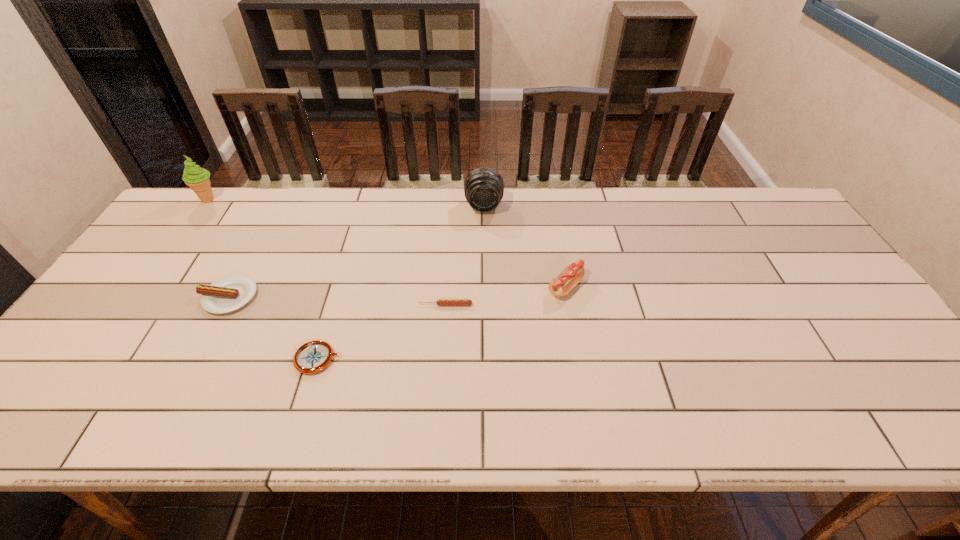
Identify the location of vacant area between the fifth shortest object and the leftmost sausage. (356, 251).

The image size is (960, 540). Find the location of `free point between the leftmost sausage and the tallest sausage`. free point between the leftmost sausage and the tallest sausage is located at coordinates (397, 292).

Locate an element on the screen. vacant space in between the leftmost sausage and the second sausage from left to right is located at coordinates (337, 301).

Locate an element on the screen. free point between the fifth object from right to left and the third tallest object is located at coordinates (397, 292).

Where is `free space that is in between the tallest sausage and the leftmost object`? This screenshot has height=540, width=960. free space that is in between the tallest sausage and the leftmost object is located at coordinates (387, 243).

You are a GUI agent. You are given a task and a screenshot of the screen. Output one action in this format:
    pyautogui.click(x=<x>, y=<y>)
    Task: Click on the object that stands as the fourth closest to the fifth shortest object
    The height and width of the screenshot is (540, 960).
    Given the screenshot: What is the action you would take?
    tap(229, 293)

The height and width of the screenshot is (540, 960). What are the coordinates of `the third closest object to the telephoto lens` in the screenshot? It's located at (312, 357).

Locate an element on the screen. This screenshot has width=960, height=540. the closest sausage to the fifth shortest object is located at coordinates (561, 285).

Locate an element on the screen. The width and height of the screenshot is (960, 540). the closest sausage to the leftmost object is located at coordinates (229, 293).

Where is `free region that satisfies the following two spatial constraints: 1. at the front element of the rightmost sausage; 2. on the left side of the telephoto lens`? The width and height of the screenshot is (960, 540). free region that satisfies the following two spatial constraints: 1. at the front element of the rightmost sausage; 2. on the left side of the telephoto lens is located at coordinates (485, 287).